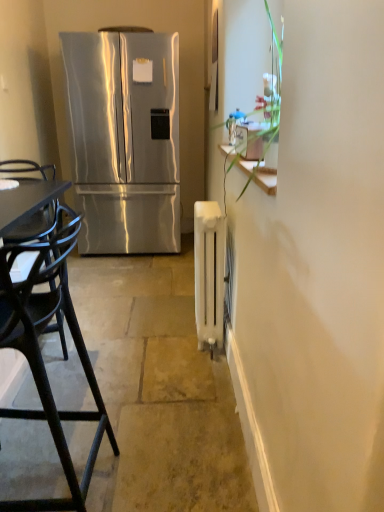
Locate an element on the screen. This screenshot has width=384, height=512. vacant space situated on the left part of white matte radiator at center is located at coordinates (164, 336).